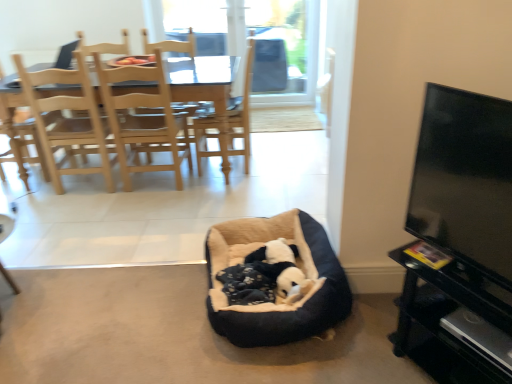
Question: Does black plush dog bed at center have a greater height compared to flat screen tv at right?

Choices:
 (A) no
 (B) yes

Answer: (A)

Question: Is black plush dog bed at center outside flat screen tv at right?

Choices:
 (A) no
 (B) yes

Answer: (B)

Question: From the image's perspective, is black plush dog bed at center under flat screen tv at right?

Choices:
 (A) yes
 (B) no

Answer: (A)

Question: Is black plush dog bed at center next to flat screen tv at right?

Choices:
 (A) yes
 (B) no

Answer: (B)

Question: Is black plush dog bed at center to the left of flat screen tv at right from the viewer's perspective?

Choices:
 (A) yes
 (B) no

Answer: (A)

Question: Is black plush dog bed at center turned away from flat screen tv at right?

Choices:
 (A) no
 (B) yes

Answer: (A)

Question: Does black plush dog bed at center have a smaller size compared to light wood dining chair at upper left?

Choices:
 (A) yes
 (B) no

Answer: (A)

Question: Is black plush dog bed at center further to the viewer compared to light wood dining chair at upper left?

Choices:
 (A) yes
 (B) no

Answer: (B)

Question: Does black plush dog bed at center lie in front of light wood dining chair at upper left?

Choices:
 (A) no
 (B) yes

Answer: (B)

Question: From the image's perspective, does black plush dog bed at center appear higher than light wood dining chair at upper left?

Choices:
 (A) no
 (B) yes

Answer: (A)

Question: Does black plush dog bed at center appear on the left side of light wood dining chair at upper left?

Choices:
 (A) yes
 (B) no

Answer: (B)

Question: From a real-world perspective, is black plush dog bed at center over light wood dining chair at upper left?

Choices:
 (A) yes
 (B) no

Answer: (B)

Question: From a real-world perspective, is light brown wood chair at left, the first chair in the right-to-left sequence, beneath soft fleece dog bed at center?

Choices:
 (A) no
 (B) yes

Answer: (A)